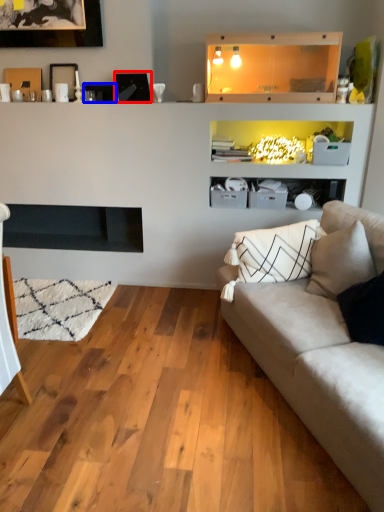
Question: Which point is further to the camera, picture frame (highlighted by a red box) or picture frame (highlighted by a blue box)?

Choices:
 (A) picture frame
 (B) picture frame

Answer: (B)